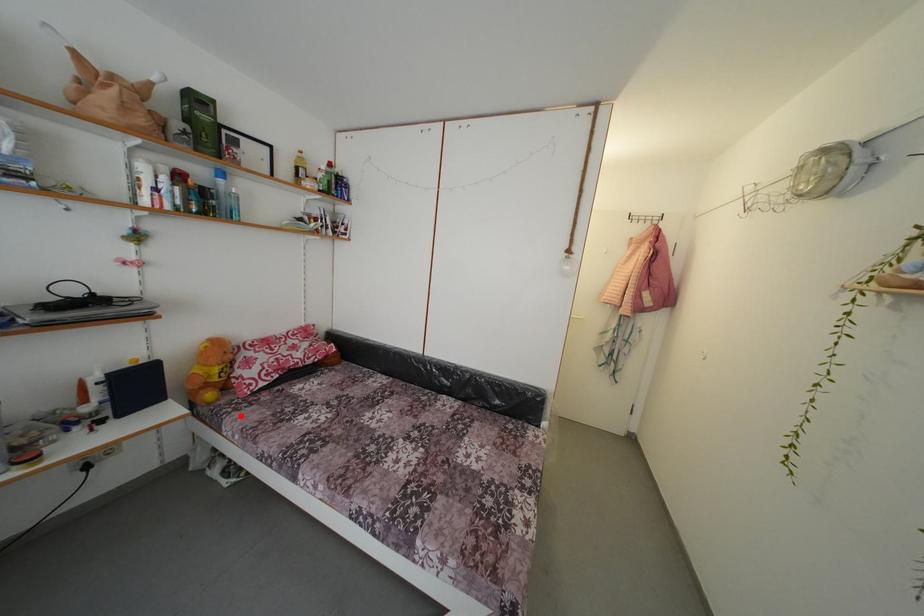
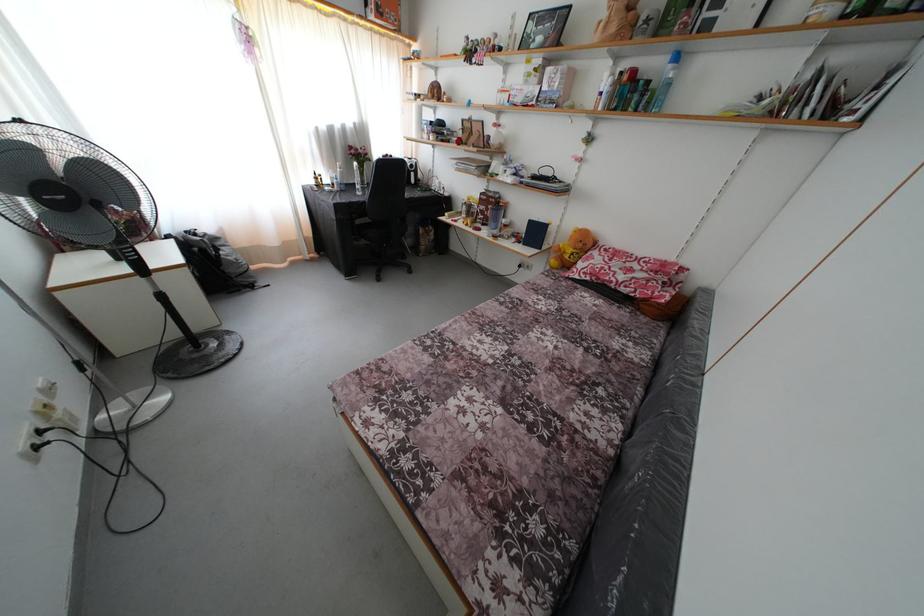
Question: I am providing you with two images of the same scene from different viewpoints. A red point is marked on the first image. At the location where the point appears in image 1, is it still visible in image 2?

Choices:
 (A) Yes
 (B) No

Answer: (A)